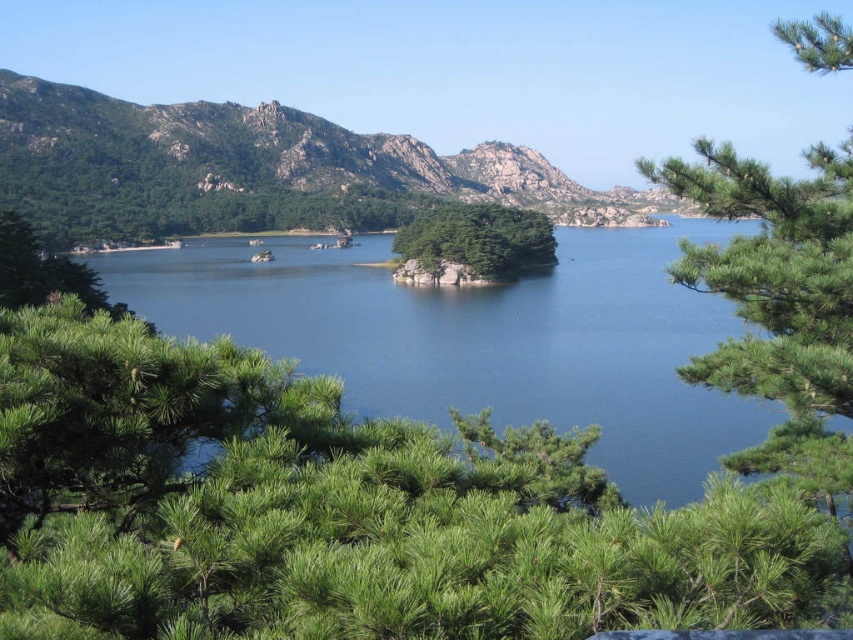
Question: In this image, where is blue water at center located relative to green leafy tree at center?

Choices:
 (A) right
 (B) left

Answer: (B)

Question: Which of the following is the farthest from the observer?

Choices:
 (A) (679, 268)
 (B) (279, 346)
 (C) (396, 252)

Answer: (C)

Question: Which point appears closest to the camera in this image?

Choices:
 (A) (640, 436)
 (B) (825, 355)

Answer: (B)

Question: Based on their relative distances, which object is nearer to the green leafy tree at center?

Choices:
 (A) blue water at center
 (B) green needle-like leaves at upper right

Answer: (A)

Question: Observing the image, what is the correct spatial positioning of green needle-like leaves at upper right in reference to green leafy tree at center?

Choices:
 (A) below
 (B) above

Answer: (A)

Question: Can you confirm if blue water at center is wider than green leafy tree at center?

Choices:
 (A) yes
 (B) no

Answer: (A)